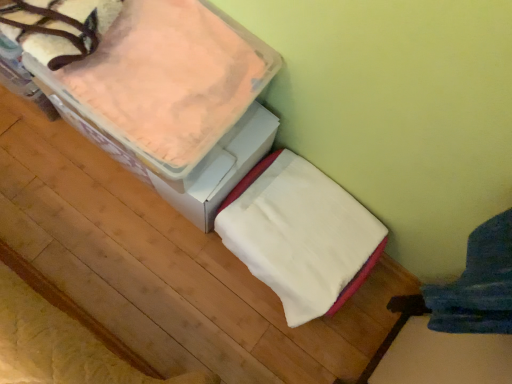
Question: Is pink fleece blanket at upper left inside white soft blanket at center?

Choices:
 (A) no
 (B) yes

Answer: (A)

Question: Is white soft blanket at center taller than pink fleece blanket at upper left?

Choices:
 (A) no
 (B) yes

Answer: (B)

Question: Is white soft blanket at center at the left side of pink fleece blanket at upper left?

Choices:
 (A) yes
 (B) no

Answer: (B)

Question: Can you confirm if white soft blanket at center is smaller than pink fleece blanket at upper left?

Choices:
 (A) yes
 (B) no

Answer: (B)

Question: Is white soft blanket at center wider than pink fleece blanket at upper left?

Choices:
 (A) no
 (B) yes

Answer: (A)

Question: From a real-world perspective, is white soft blanket at center located beneath pink fleece blanket at upper left?

Choices:
 (A) yes
 (B) no

Answer: (A)

Question: Is pink fleece blanket at upper left bigger than white soft blanket at center?

Choices:
 (A) no
 (B) yes

Answer: (A)

Question: Is pink fleece blanket at upper left turned away from white soft blanket at center?

Choices:
 (A) yes
 (B) no

Answer: (B)

Question: Would you say pink fleece blanket at upper left is outside white soft blanket at center?

Choices:
 (A) no
 (B) yes

Answer: (B)

Question: Is pink fleece blanket at upper left positioned before white soft blanket at center?

Choices:
 (A) no
 (B) yes

Answer: (B)

Question: Is the position of pink fleece blanket at upper left more distant than that of white soft blanket at center?

Choices:
 (A) no
 (B) yes

Answer: (A)

Question: From the image's perspective, does pink fleece blanket at upper left appear lower than white soft blanket at center?

Choices:
 (A) no
 (B) yes

Answer: (A)

Question: Considering their positions, is pink fleece blanket at upper left located in front of or behind white soft blanket at center?

Choices:
 (A) behind
 (B) front

Answer: (B)